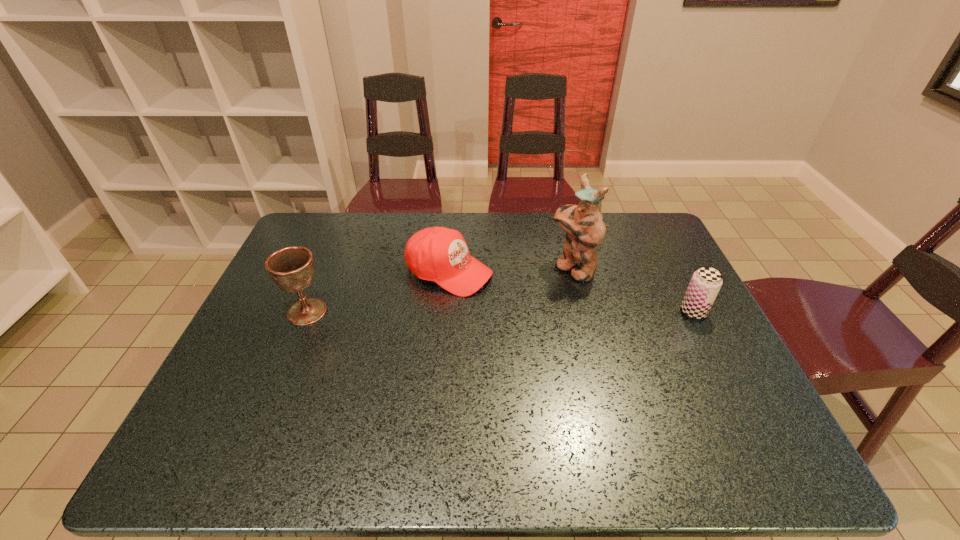
Locate an element on the screen. This screenshot has width=960, height=540. vacant area that lies between the rightmost object and the baseball cap is located at coordinates (571, 292).

Where is `free spot between the leftmost object and the rightmost object`? free spot between the leftmost object and the rightmost object is located at coordinates (500, 312).

The height and width of the screenshot is (540, 960). In order to click on free spot between the chalice and the third object from right to left in this screenshot , I will do `click(378, 292)`.

Locate an element on the screen. unoccupied position between the third shortest object and the tallest object is located at coordinates (440, 290).

Where is `free area in between the leftmost object and the beer can`? free area in between the leftmost object and the beer can is located at coordinates (500, 312).

Where is `the closest object relative to the third object from right to left`? The width and height of the screenshot is (960, 540). the closest object relative to the third object from right to left is located at coordinates (585, 227).

Locate an element on the screen. This screenshot has width=960, height=540. object identified as the second closest to the baseball cap is located at coordinates (291, 268).

Find the location of a particular element. This screenshot has width=960, height=540. vacant point that satisfies the following two spatial constraints: 1. on the front side of the rightmost object; 2. on the left side of the tallest object is located at coordinates (584, 312).

The height and width of the screenshot is (540, 960). Find the location of `vacant space that satisfies the following two spatial constraints: 1. on the front side of the third object from right to left; 2. on the left side of the rightmost object`. vacant space that satisfies the following two spatial constraints: 1. on the front side of the third object from right to left; 2. on the left side of the rightmost object is located at coordinates (445, 312).

This screenshot has width=960, height=540. I want to click on vacant space that satisfies the following two spatial constraints: 1. on the front side of the third object from left to right; 2. on the left side of the rightmost object, so click(x=584, y=312).